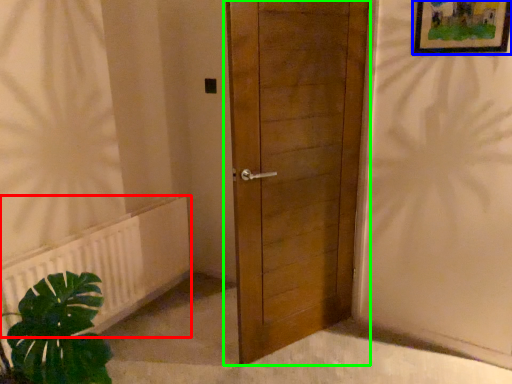
Question: Estimate the real-world distances between objects in this image. Which object is closer to radiator (highlighted by a red box), picture frame (highlighted by a blue box) or door (highlighted by a green box)?

Choices:
 (A) picture frame
 (B) door

Answer: (B)